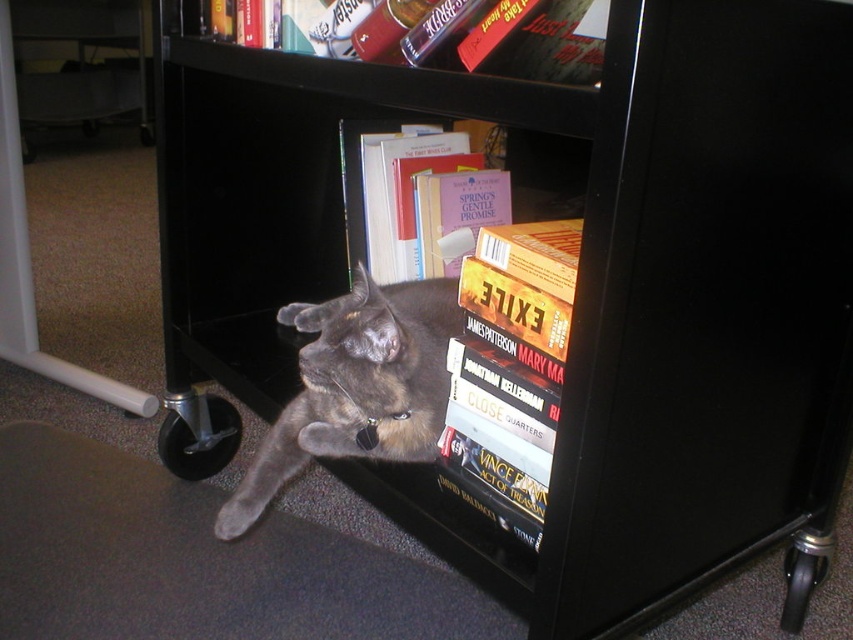
Question: Is gray fur cat at lower center below gray fur cat at center?

Choices:
 (A) yes
 (B) no

Answer: (A)

Question: Does gray fur cat at lower center lie behind gray fur cat at center?

Choices:
 (A) yes
 (B) no

Answer: (A)

Question: Is gray fur cat at lower center thinner than gray fur cat at center?

Choices:
 (A) yes
 (B) no

Answer: (B)